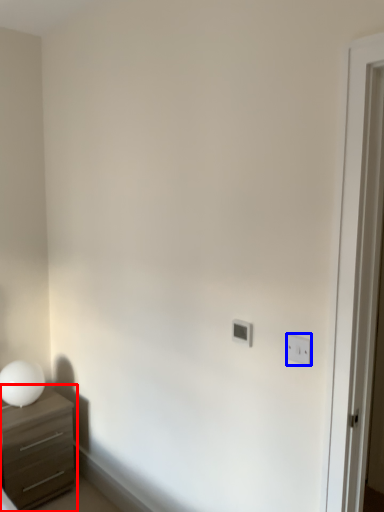
Question: Among these objects, which one is farthest to the camera, chest of drawers (highlighted by a red box) or light switch (highlighted by a blue box)?

Choices:
 (A) chest of drawers
 (B) light switch

Answer: (A)